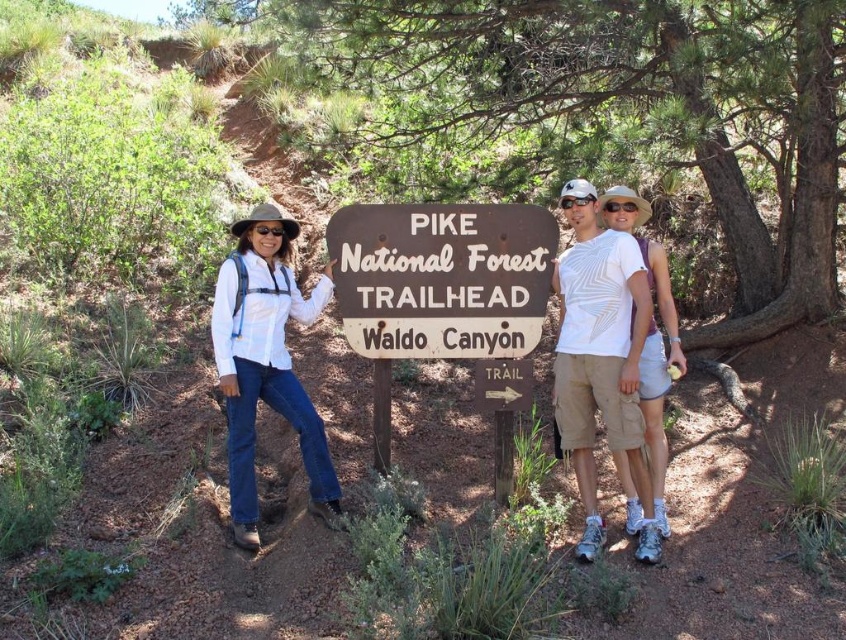
You are standing at the trailhead and want to find the Pike National Forest Trailhead sign. According to the scene description, where is the brown wooden sign at center located in terms of its 2D coordinates?

The brown wooden sign at center is located at the 2D coordinates point (442, 276).

Consider the image. You are standing at the Pike National Forest Trailhead and notice the brown wooden sign at center and the white textured shirt at center. Which object is closer to you based on their positions?

The brown wooden sign at center is positioned over the white textured shirt at center, meaning the brown wooden sign at center is closer to you.